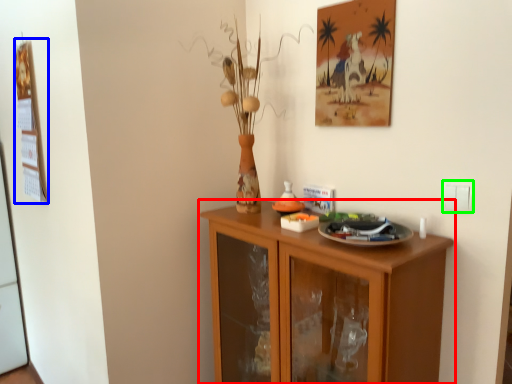
Question: Based on their relative distances, which object is nearer to cabinetry (highlighted by a red box)? Choose from picture frame (highlighted by a blue box) and electric outlet (highlighted by a green box).

Choices:
 (A) picture frame
 (B) electric outlet

Answer: (B)